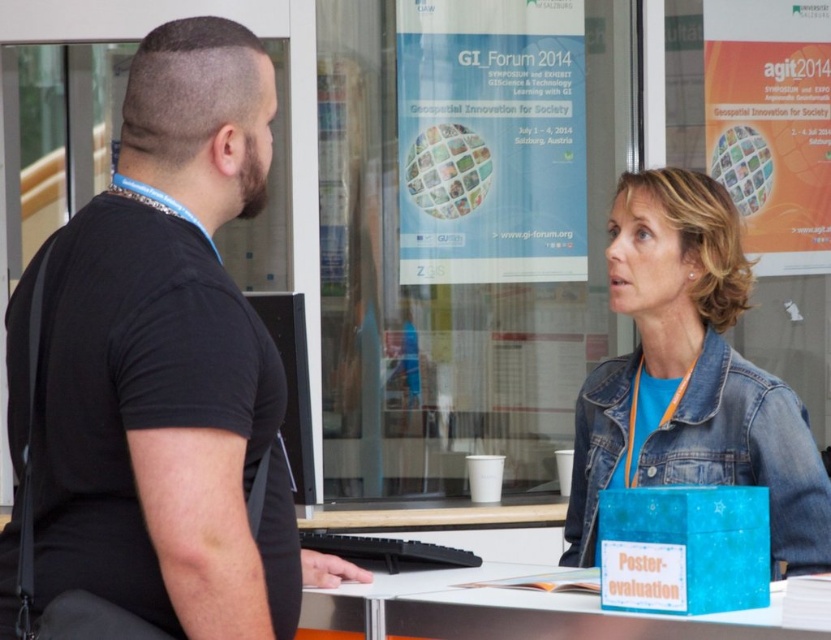
Question: Can you confirm if black matte shirt at left is positioned below denim jacket at lower right?

Choices:
 (A) yes
 (B) no

Answer: (B)

Question: Which point is closer to the camera?

Choices:
 (A) black matte shirt at left
 (B) denim jacket at lower right
 (C) blue plastic table at lower center

Answer: (A)

Question: Does black matte shirt at left come behind blue plastic table at lower center?

Choices:
 (A) no
 (B) yes

Answer: (A)

Question: Which of the following is the closest to the observer?

Choices:
 (A) blue plastic table at lower center
 (B) black matte shirt at left
 (C) denim jacket at lower right

Answer: (B)

Question: Which is farther from the black matte shirt at left?

Choices:
 (A) denim jacket at lower right
 (B) blue plastic table at lower center

Answer: (A)

Question: Is black matte shirt at left bigger than denim jacket at lower right?

Choices:
 (A) yes
 (B) no

Answer: (A)